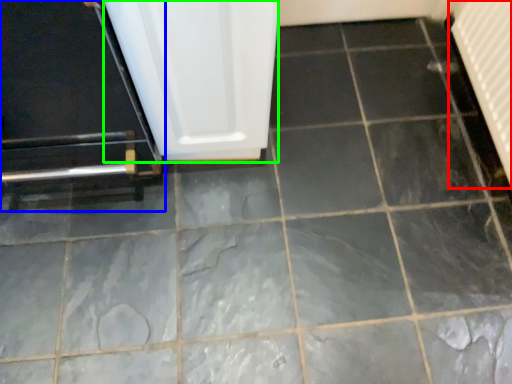
Question: Estimate the real-world distances between objects in this image. Which object is closer to radiator (highlighted by a red box), door (highlighted by a blue box) or screen door (highlighted by a green box)?

Choices:
 (A) door
 (B) screen door

Answer: (B)